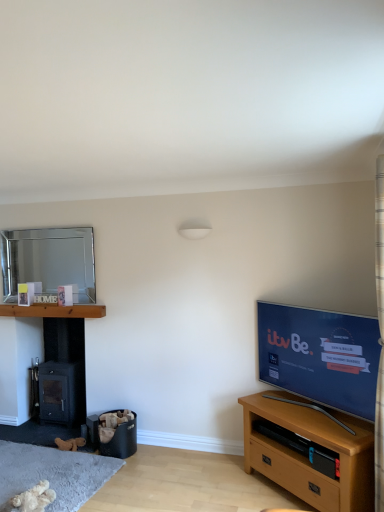
Question: Is fluffy beige teddy bear at lower left inside or outside of wooden tv stand at lower right, acting as the 1th shelf starting from the right?

Choices:
 (A) outside
 (B) inside

Answer: (A)

Question: In the image, is fluffy beige teddy bear at lower left positioned in front of or behind wooden tv stand at lower right, which ranks as the 1th shelf in bottom-to-top order?

Choices:
 (A) behind
 (B) front

Answer: (B)

Question: Which of these objects is positioned farthest from the black plastic trash bin at lower left?

Choices:
 (A) wooden at left, which is the 2th shelf in bottom-to-top order
 (B) wooden tv stand at lower right, which ranks as the 1th shelf in bottom-to-top order
 (C) light brown wooden tv stand at lower right
 (D) fluffy beige teddy bear at lower left
 (E) matte black tv at right

Answer: (E)

Question: Which is farther from the silver metallic mirror at upper left?

Choices:
 (A) wooden tv stand at lower right, which is counted as the second shelf, starting from the top
 (B) wooden at left, which is the 2th shelf in bottom-to-top order
 (C) black plastic trash bin at lower left
 (D) plaid fabric curtain at upper right
 (E) matte black tv at right

Answer: (D)